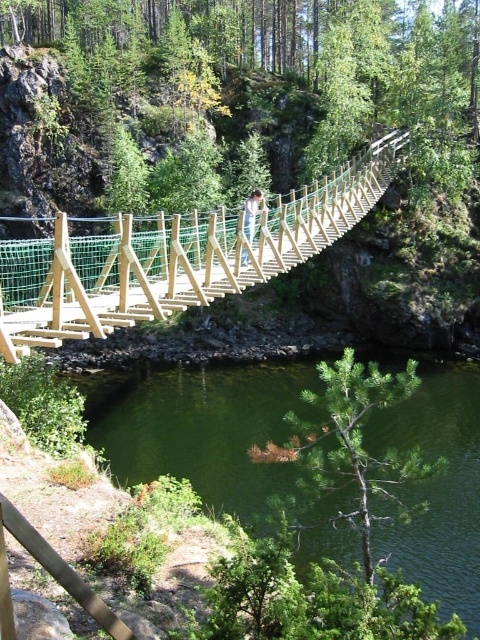
Question: Does wooden suspension bridge at center have a lesser width compared to wooden post at center?

Choices:
 (A) no
 (B) yes

Answer: (A)

Question: Based on their relative distances, which object is farther from the wooden suspension bridge at center?

Choices:
 (A) wooden post at center
 (B) green water at lower center

Answer: (B)

Question: Can you confirm if green water at lower center is smaller than wooden post at center?

Choices:
 (A) yes
 (B) no

Answer: (B)

Question: Which point appears farthest from the camera in this image?

Choices:
 (A) (467, 518)
 (B) (243, 211)

Answer: (A)

Question: Does wooden suspension bridge at center have a lesser width compared to wooden post at center?

Choices:
 (A) yes
 (B) no

Answer: (B)

Question: Which of the following is the closest to the observer?

Choices:
 (A) wooden post at center
 (B) green water at lower center

Answer: (A)